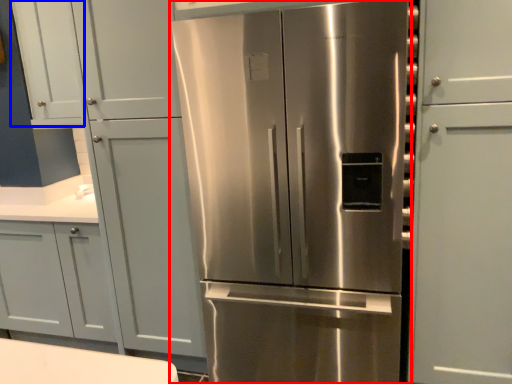
Question: Which object appears closest to the camera in this image, refrigerator (highlighted by a red box) or door (highlighted by a blue box)?

Choices:
 (A) refrigerator
 (B) door

Answer: (A)